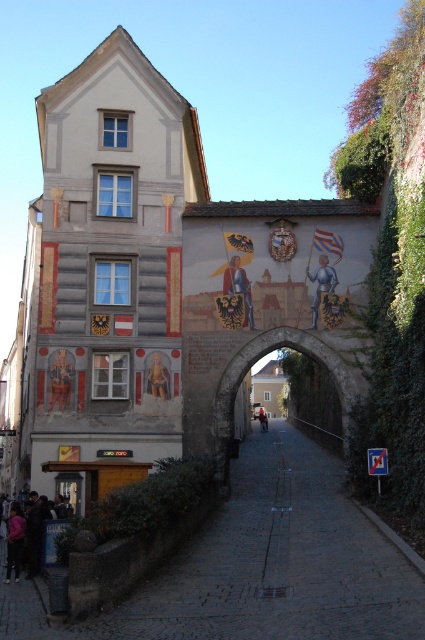
You are standing in front of a historic European building with a stone archway. You see a point marked at coordinates (28, 536). What object is located at that point?

The point at coordinates (28, 536) indicates dark blue jeans at lower left.